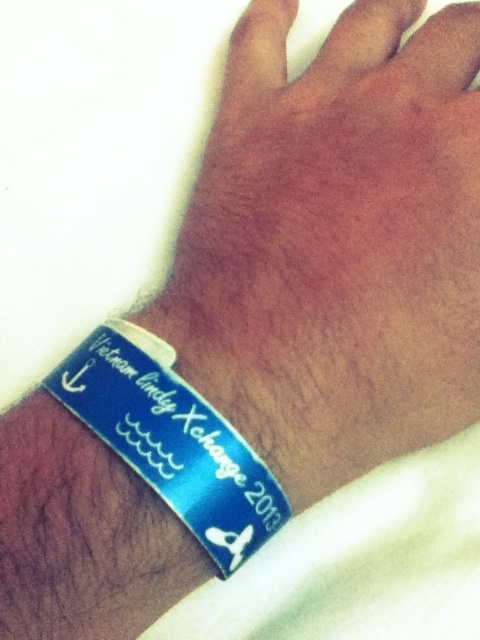
You are a photographer trying to capture the blue matte wristband at lower left and the blue glossy wristband at lower left in a photo. Which wristband should you focus on first if you want to highlight the one that is more to the right?

The blue matte wristband at lower left is positioned on the right side of blue glossy wristband at lower left, so you should focus on the blue matte wristband at lower left first to highlight the one more to the right.

You are a photographer trying to capture the blue matte wristband at lower left and the blue glossy wristband at lower left. Which one will appear closer to you in the photo?

The blue matte wristband at lower left will appear closer to you in the photo because it is positioned further to the viewer than the blue glossy wristband at lower left.

You are taking a photo of the wristband and want to focus on the anchor symbol. Since the anchor symbol is at point (440, 326) and the bird graphic is at point (134, 401), which point should you adjust your camera focus to ensure the anchor symbol is sharp?

Point (440, 326) is further to the camera than point (134, 401), so you should focus on point (440, 326) to ensure the anchor symbol is sharp.